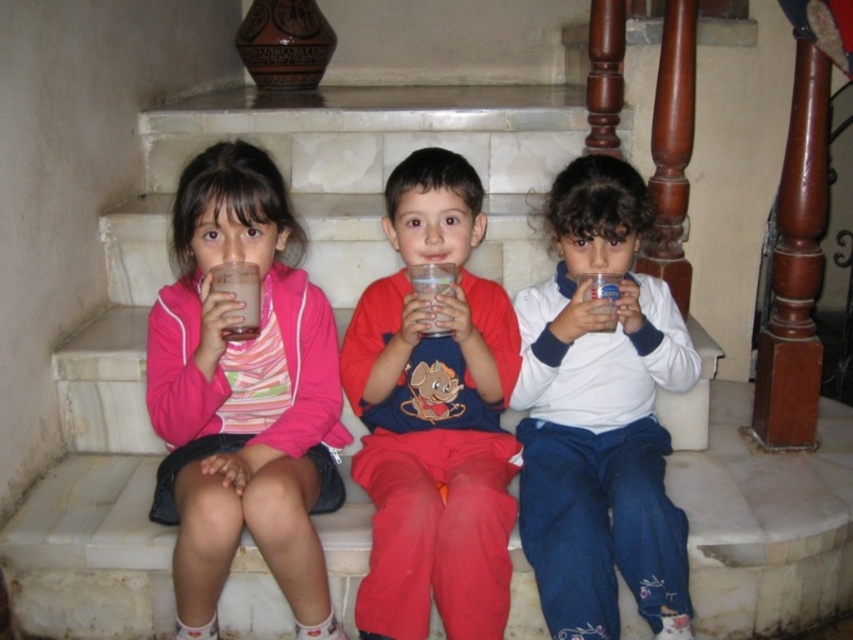
Please describe the position of the pink matte jacket at center in terms of coordinates on the image plane, where the origin is at the bottom left corner of the image and the axes are normalized between 0 and 1.

The pink matte jacket at center is located at coordinates approximately 0.620 along the x axis and 0.286 along the y axis on the image plane.

You are a photographer trying to capture a candid shot of the children on the marble steps. You notice the milky white liquid at left and the transparent plastic cup at center. Which object is positioned closer to your camera lens?

The milky white liquid at left is closer to the viewer than the transparent plastic cup at center, so the milky white liquid at left would be closer to the camera lens.